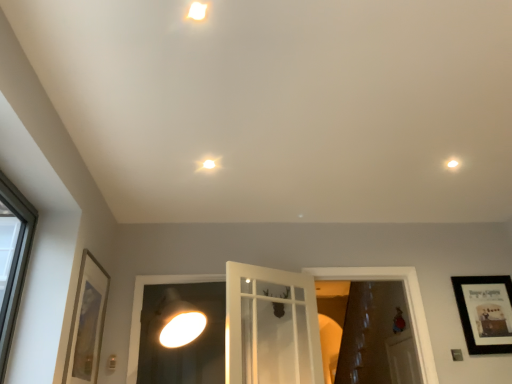
Question: Is black matte picture frame at upper right, which is counted as the first picture frame, starting from the right, spatially inside white glossy droplight at upper right, the 2th droplight viewed from the top, or outside of it?

Choices:
 (A) outside
 (B) inside

Answer: (A)

Question: Is black matte picture frame at upper right, which is counted as the first picture frame, starting from the right, to the left or to the right of white glossy droplight at upper right, the first droplight positioned from the back, in the image?

Choices:
 (A) right
 (B) left

Answer: (A)

Question: Which is nearer to the black matte picture frame at upper right, which ranks as the second picture frame in front-to-back order?

Choices:
 (A) white glossy droplight at upper center, acting as the 3th droplight starting from the bottom
 (B) white glossy door at center, positioned as the 1th window frame in right-to-left order
 (C) white glossy droplight at upper right, the 3th droplight viewed from the left
 (D) gold-framed picture at left, which is counted as the 1th picture frame, starting from the front
 (E) matte white droplight at center, placed as the 1th droplight when sorted from bottom to top

Answer: (B)

Question: Estimate the real-world distances between objects in this image. Which object is farther from the black matte picture frame at upper right, which is the second picture frame in left-to-right order?

Choices:
 (A) white glass door at center, the first window frame in the left-to-right sequence
 (B) gold-framed picture at left, which is counted as the 1th picture frame, starting from the left
 (C) white glossy droplight at upper center, which ranks as the 2th droplight in right-to-left order
 (D) white glossy droplight at upper right, the 1th droplight viewed from the right
 (E) matte white droplight at center, placed as the first droplight when sorted from left to right

Answer: (C)